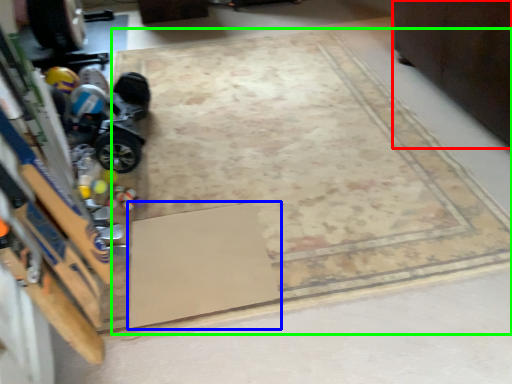
Question: Which object is positioned farthest from furniture (highlighted by a red box)? Select from doormat (highlighted by a blue box) and mat (highlighted by a green box).

Choices:
 (A) doormat
 (B) mat

Answer: (A)